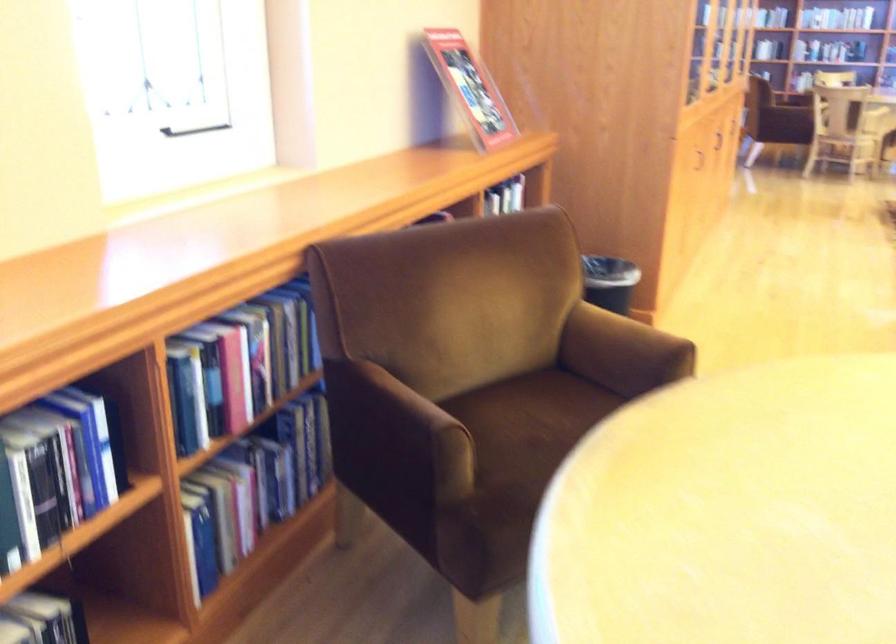
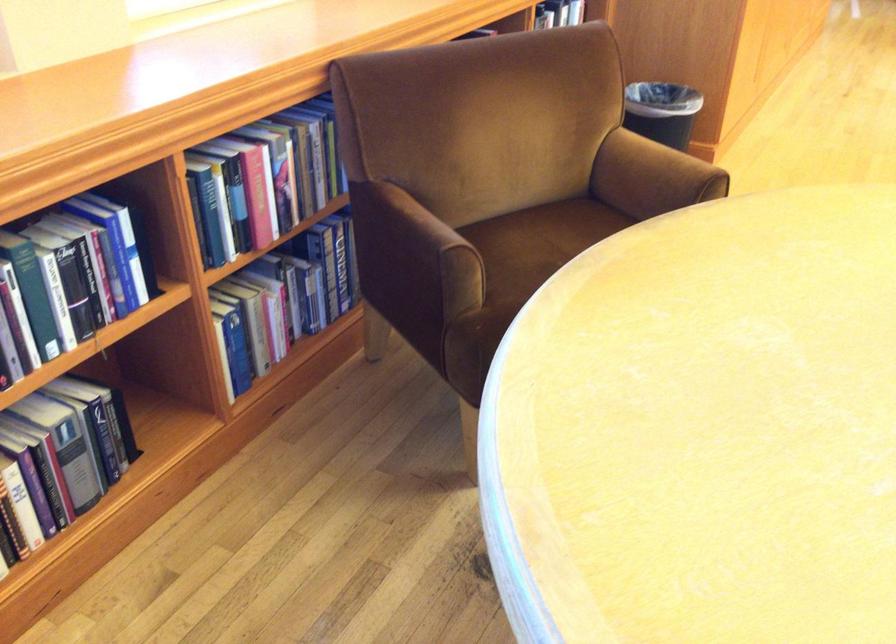
In the second image, find the point that corresponds to point (239, 364) in the first image.

(263, 178)